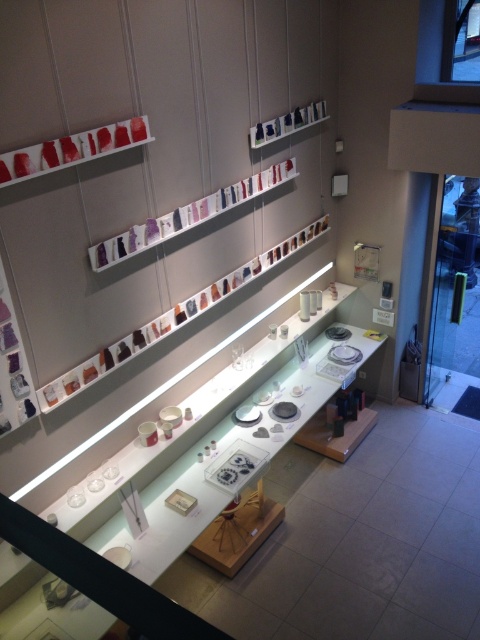
Question: Is purple glassware at upper center below matte plastic shelves at upper center?

Choices:
 (A) no
 (B) yes

Answer: (B)

Question: Which object is farther from the camera taking this photo?

Choices:
 (A) matte glass jewelry at center
 (B) matte red glassware at upper left
 (C) matte plastic shelves at upper center

Answer: (C)

Question: Is matte glass jewelry at center to the right of matte plastic shelves at upper center from the viewer's perspective?

Choices:
 (A) no
 (B) yes

Answer: (A)

Question: Estimate the real-world distances between objects in this image. Which object is farther from the purple glassware at upper center?

Choices:
 (A) matte plastic shelves at upper center
 (B) matte red glassware at upper left

Answer: (B)

Question: Can you confirm if matte glass jewelry at center is positioned above purple glassware at upper center?

Choices:
 (A) no
 (B) yes

Answer: (B)

Question: Considering the real-world distances, which object is farthest from the matte plastic shelves at upper center?

Choices:
 (A) purple glassware at upper center
 (B) matte red glassware at upper left
 (C) matte glass jewelry at center

Answer: (B)